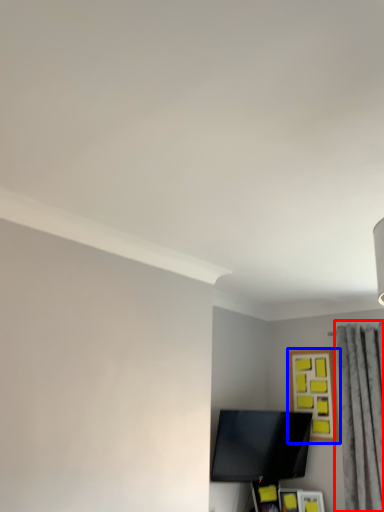
Question: Among these objects, which one is nearest to the camera, curtain (highlighted by a red box) or picture frame (highlighted by a blue box)?

Choices:
 (A) curtain
 (B) picture frame

Answer: (A)